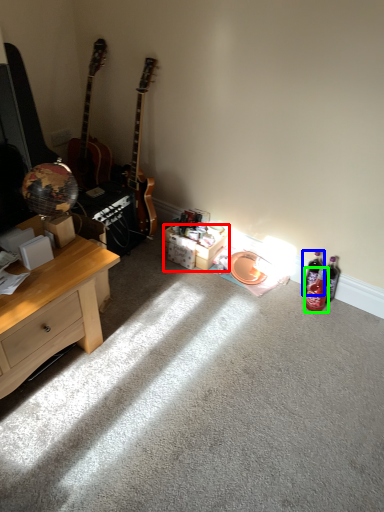
Question: Which is farther away from box (highlighted by a red box)? bottle (highlighted by a blue box) or bottle (highlighted by a green box)?

Choices:
 (A) bottle
 (B) bottle

Answer: (B)